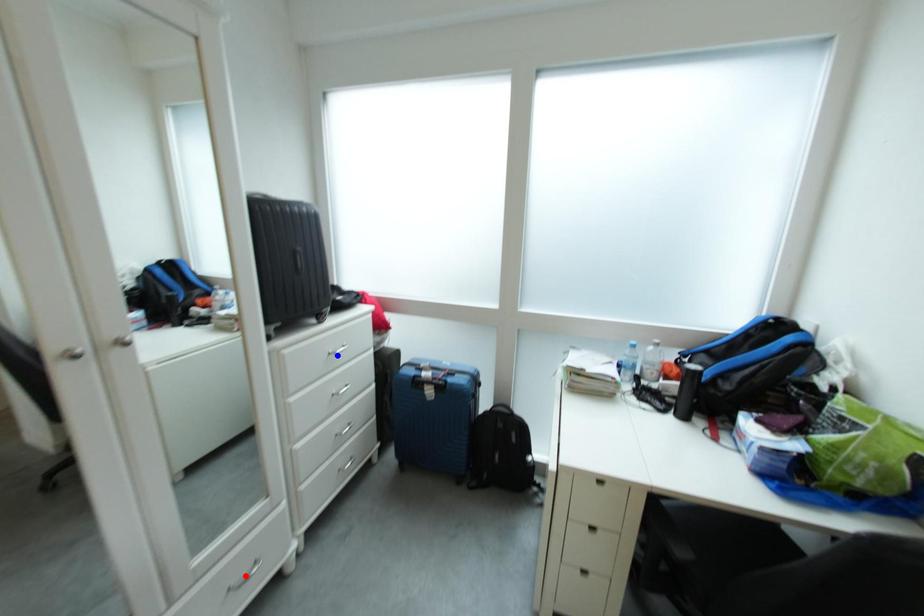
Question: Two points are marked on the image. Which point is closer to the camera?

Choices:
 (A) Blue point is closer.
 (B) Red point is closer.

Answer: (B)